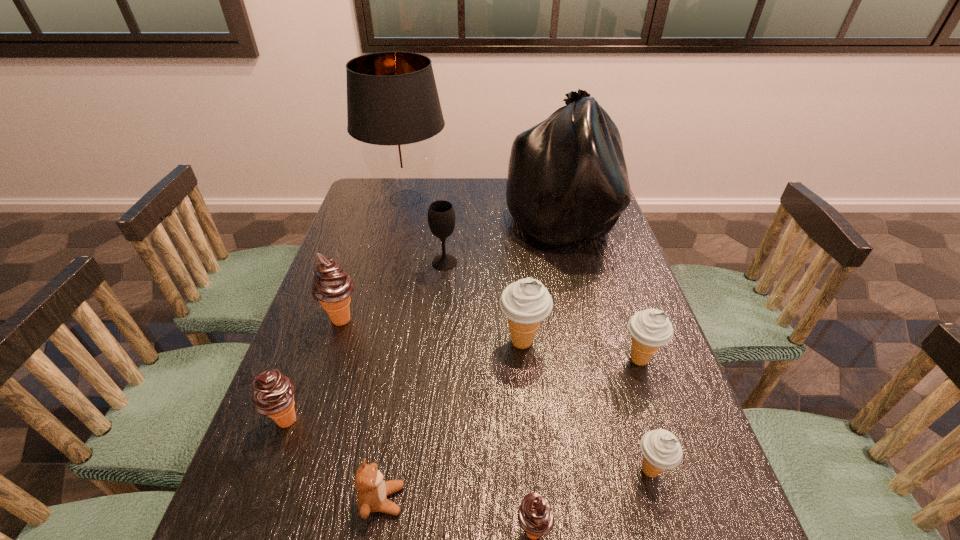
This screenshot has height=540, width=960. I want to click on lampshade located in the far edge section of the desktop, so click(x=393, y=106).

Identify the location of plastic bag at the far edge. This screenshot has width=960, height=540. (567, 180).

This screenshot has width=960, height=540. What are the coordinates of `lampshade that is at the left edge` in the screenshot? It's located at (393, 106).

Where is `plastic bag that is at the right edge`? plastic bag that is at the right edge is located at coordinates (567, 180).

This screenshot has width=960, height=540. Find the location of `object at the far left corner`. object at the far left corner is located at coordinates (393, 106).

The width and height of the screenshot is (960, 540). In order to click on object that is at the far right corner in this screenshot , I will do coord(567,180).

Identify the location of vacant area at the far edge. This screenshot has height=540, width=960. (483, 182).

In order to click on vacant position at the left edge of the desktop in this screenshot , I will do `click(389, 234)`.

You are a GUI agent. You are given a task and a screenshot of the screen. Output one action in this format:
    pyautogui.click(x=<x>, y=<y>)
    Task: Click on the free space at the right edge
    The width and height of the screenshot is (960, 540).
    Given the screenshot: What is the action you would take?
    660,516

I want to click on vacant point located between the leftmost beige icecream and the teddy bear, so click(x=452, y=421).